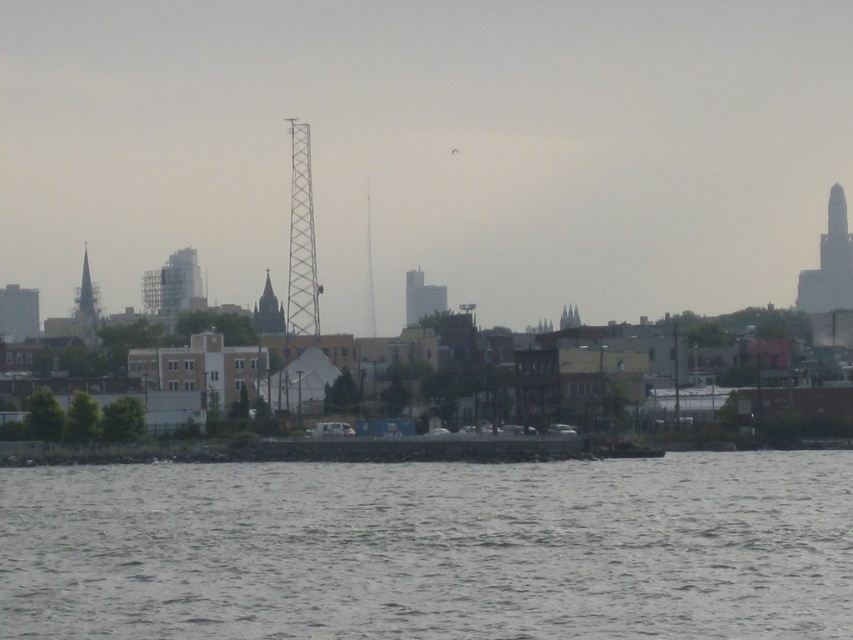
Between point (308, 248) and point (271, 292), which one is positioned behind?

The point (271, 292) is more distant.

Does metallic tower at center have a greater height compared to dark gray stone spire at center?

Indeed, metallic tower at center has a greater height compared to dark gray stone spire at center.

Identify the location of metallic tower at center. (300, 237).

In the scene shown: Is metallic tower at center positioned before smooth gray tower at center?

Yes, metallic tower at center is in front of smooth gray tower at center.

Between metallic tower at center and smooth gray tower at center, which one appears on the right side from the viewer's perspective?

smooth gray tower at center is more to the right.

Is point (294, 154) positioned before point (405, 276)?

No, (294, 154) is behind (405, 276).

At what (x,y) coordinates should I click in order to perform the action: click on metallic tower at center. Please return your answer as a coordinate pair (x, y). Looking at the image, I should click on (300, 237).

Looking at this image, is smooth gray tower at center smaller than smooth gray steeple at left?

Yes.

Who is more distant from viewer, (410, 291) or (86, 269)?

Positioned behind is point (86, 269).

The width and height of the screenshot is (853, 640). I want to click on smooth gray tower at center, so click(x=422, y=298).